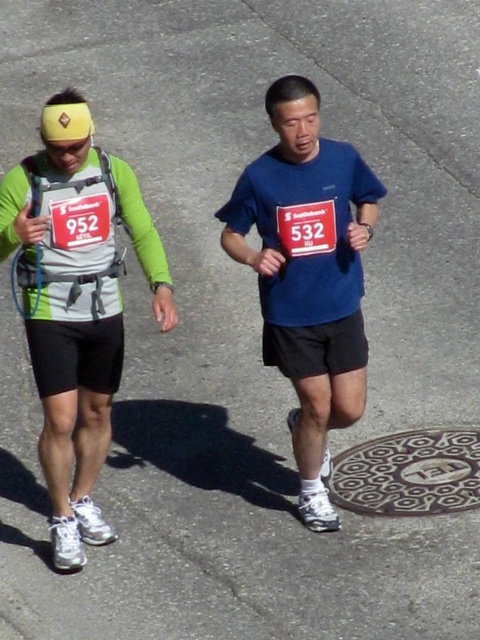
Who is positioned more to the left, matte green shirt at left or blue matte shirt at center?

matte green shirt at left

Is matte green shirt at left below blue matte shirt at center?

Indeed, matte green shirt at left is positioned under blue matte shirt at center.

Find the location of a particular element. matte green shirt at left is located at coordinates (76, 304).

In order to click on matte green shirt at left in this screenshot , I will do `click(76, 304)`.

Does matte green shirt at left have a greater height compared to metallic textured manhole cover at lower center?

Correct, matte green shirt at left is much taller as metallic textured manhole cover at lower center.

Between matte green shirt at left and metallic textured manhole cover at lower center, which one has more height?

matte green shirt at left is taller.

Is point (48, 125) farther from camera compared to point (346, 458)?

No, (48, 125) is in front of (346, 458).

This screenshot has width=480, height=640. What are the coordinates of `matte green shirt at left` in the screenshot? It's located at (76, 304).

Who is shorter, blue matte shirt at center or metallic textured manhole cover at lower center?

metallic textured manhole cover at lower center is shorter.

Which is more to the right, blue matte shirt at center or metallic textured manhole cover at lower center?

Positioned to the right is metallic textured manhole cover at lower center.

Identify the location of blue matte shirt at center. The height and width of the screenshot is (640, 480). (308, 275).